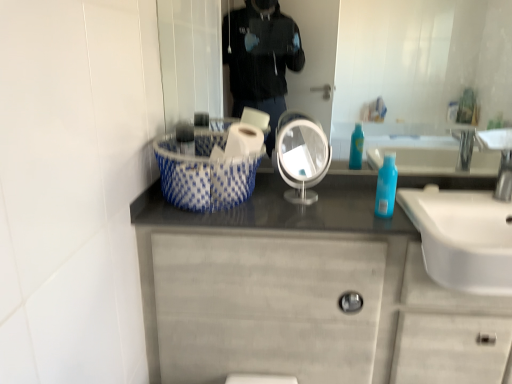
Question: Does matte silver mirror at center, which is the second mirror in left-to-right order, appear on the right side of blue dotted fabric basket at center?

Choices:
 (A) no
 (B) yes

Answer: (B)

Question: Is matte silver mirror at center, marked as the first mirror in a right-to-left arrangement, not near blue dotted fabric basket at center?

Choices:
 (A) no
 (B) yes

Answer: (B)

Question: Is matte silver mirror at center, marked as the first mirror in a right-to-left arrangement, wider than blue dotted fabric basket at center?

Choices:
 (A) no
 (B) yes

Answer: (A)

Question: From a real-world perspective, is matte silver mirror at center, which is the second mirror in left-to-right order, below blue dotted fabric basket at center?

Choices:
 (A) no
 (B) yes

Answer: (A)

Question: Is matte silver mirror at center, which is the second mirror in left-to-right order, surrounding blue dotted fabric basket at center?

Choices:
 (A) no
 (B) yes

Answer: (A)

Question: In terms of size, does white glossy sink at right appear bigger or smaller than matte silver mirror at center, marked as the first mirror in a right-to-left arrangement?

Choices:
 (A) big
 (B) small

Answer: (A)

Question: From their relative heights in the image, would you say white glossy sink at right is taller or shorter than matte silver mirror at center, marked as the first mirror in a right-to-left arrangement?

Choices:
 (A) tall
 (B) short

Answer: (B)

Question: Is white glossy sink at right in front of or behind matte silver mirror at center, which is the second mirror in left-to-right order, in the image?

Choices:
 (A) front
 (B) behind

Answer: (A)

Question: Is point (444, 286) positioned closer to the camera than point (348, 104)?

Choices:
 (A) closer
 (B) farther

Answer: (A)

Question: Considering the positions of point (282, 170) and point (233, 145), is point (282, 170) closer or farther from the camera than point (233, 145)?

Choices:
 (A) farther
 (B) closer

Answer: (A)

Question: Is white glossy mirror at center, the first mirror in the left-to-right sequence, inside or outside of white glossy toilet paper at center?

Choices:
 (A) inside
 (B) outside

Answer: (B)

Question: Visually, is white glossy mirror at center, the first mirror in the left-to-right sequence, positioned to the left or to the right of white glossy toilet paper at center?

Choices:
 (A) left
 (B) right

Answer: (B)

Question: From the image's perspective, is white glossy mirror at center, the 2th mirror viewed from the right, positioned above or below white glossy toilet paper at center?

Choices:
 (A) below
 (B) above

Answer: (A)

Question: Does point (435, 243) appear closer or farther from the camera than point (501, 375)?

Choices:
 (A) closer
 (B) farther

Answer: (A)

Question: Based on their positions, is white glossy sink at right located to the left or right of matte gray cabinet at center?

Choices:
 (A) left
 (B) right

Answer: (B)